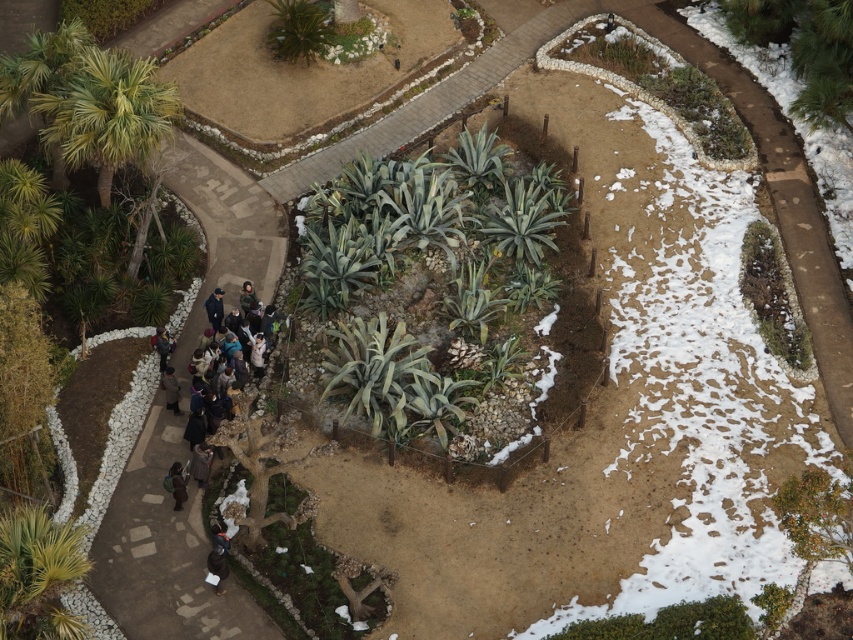
Does brown dirt path at center have a greater height compared to dark gray wool coat at center-left?

Yes, brown dirt path at center is taller than dark gray wool coat at center-left.

Which is more to the left, brown dirt path at center or dark gray wool coat at center-left?

dark gray wool coat at center-left

The image size is (853, 640). What do you see at coordinates (325, 164) in the screenshot?
I see `brown dirt path at center` at bounding box center [325, 164].

What are the coordinates of `brown dirt path at center` in the screenshot? It's located at (325, 164).

Based on the photo, is dark gray jacket at center in front of dark gray jacket at lower left?

That is True.

Is dark gray jacket at center thinner than dark gray jacket at lower left?

Yes, dark gray jacket at center is thinner than dark gray jacket at lower left.

Who is more forward, (198, 468) or (155, 349)?

Point (198, 468)

Find the location of a particular element. Image resolution: width=853 pixels, height=640 pixels. dark gray jacket at center is located at coordinates (200, 464).

Can you confirm if brown dirt path at center is positioned to the left of dark gray jacket at center?

No, brown dirt path at center is not to the left of dark gray jacket at center.

Is brown dirt path at center taller than dark gray jacket at center?

Yes.

Find the location of a particular element. The height and width of the screenshot is (640, 853). brown dirt path at center is located at coordinates (325, 164).

This screenshot has height=640, width=853. I want to click on brown dirt path at center, so click(x=325, y=164).